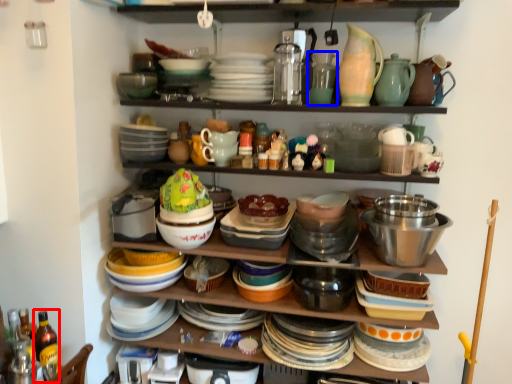
Question: Which object is further to the camera taking this photo, bottle (highlighted by a red box) or tableware (highlighted by a blue box)?

Choices:
 (A) bottle
 (B) tableware

Answer: (B)